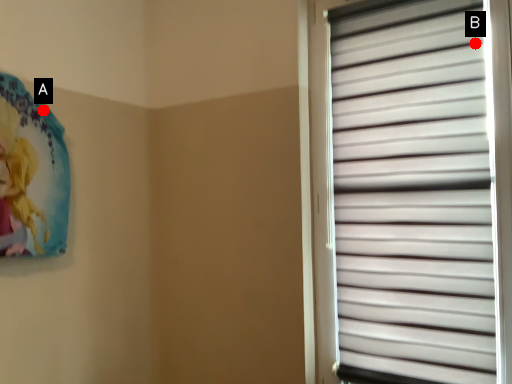
Question: Two points are circled on the image, labeled by A and B beside each circle. Which point is closer to the camera taking this photo?

Choices:
 (A) A is closer
 (B) B is closer

Answer: (B)